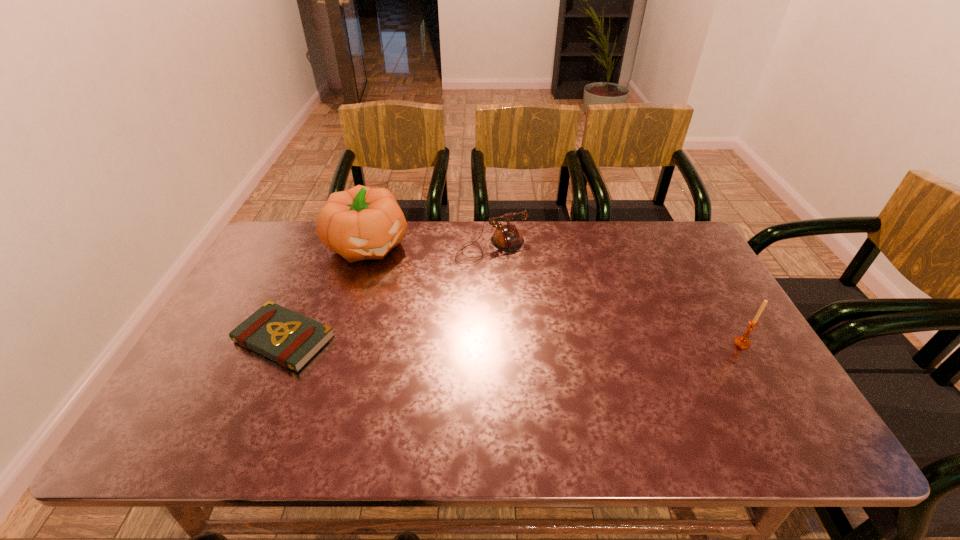
The width and height of the screenshot is (960, 540). What are the coordinates of `free spot between the pumpkin and the book` in the screenshot? It's located at (326, 292).

At what (x,y) coordinates should I click in order to perform the action: click on vacant region between the book and the third tallest object. Please return your answer as a coordinate pair (x, y). Looking at the image, I should click on (388, 293).

The height and width of the screenshot is (540, 960). I want to click on vacant area that lies between the second shortest object and the tallest object, so click(430, 246).

This screenshot has height=540, width=960. I want to click on empty location between the book and the telephone, so click(388, 293).

Locate an element on the screen. Image resolution: width=960 pixels, height=540 pixels. free space between the third object from left to right and the book is located at coordinates (388, 293).

This screenshot has height=540, width=960. In order to click on object that stands as the closest to the shortest object in this screenshot , I will do `click(361, 223)`.

This screenshot has height=540, width=960. Find the location of `the closest object to the pumpkin`. the closest object to the pumpkin is located at coordinates point(507,237).

The height and width of the screenshot is (540, 960). What are the coordinates of `free location that satisfies the following two spatial constraints: 1. on the back side of the shortest object; 2. on the left side of the pumpkin` in the screenshot? It's located at (325, 245).